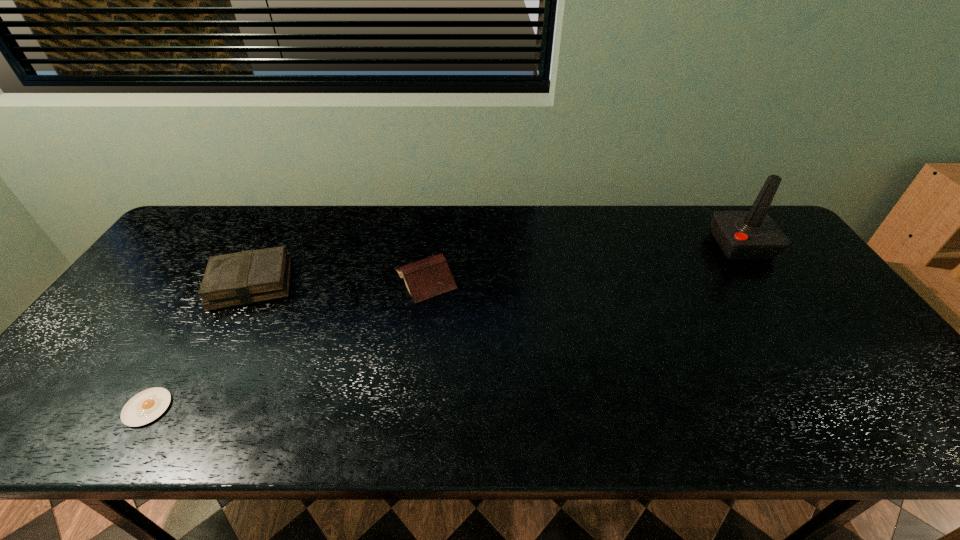
Find the location of `the rightmost object`. the rightmost object is located at coordinates (742, 235).

You are a GUI agent. You are given a task and a screenshot of the screen. Output one action in this format:
    pyautogui.click(x=<x>, y=<y>)
    Task: Click on the tallest object
    The image size is (960, 540).
    Given the screenshot: What is the action you would take?
    pyautogui.click(x=742, y=235)

Where is `the left book`? the left book is located at coordinates (247, 277).

Image resolution: width=960 pixels, height=540 pixels. Find the location of `the third object from left to right`. the third object from left to right is located at coordinates (431, 276).

Identify the location of the nearest object. (146, 406).

Where is `egg yolk`? This screenshot has width=960, height=540. egg yolk is located at coordinates (146, 406).

I want to click on free space located 0.250m on the front of the rightmost object, so click(x=798, y=327).

Where is `vacant space located 0.360m on the front of the left book`? Image resolution: width=960 pixels, height=540 pixels. vacant space located 0.360m on the front of the left book is located at coordinates (165, 441).

At what (x,y) coordinates should I click in order to perform the action: click on free space located 0.070m on the left of the right book. Please return your answer as a coordinate pair (x, y). Looking at the image, I should click on (368, 279).

Where is `vacant point located 0.250m on the back of the nearest object`? vacant point located 0.250m on the back of the nearest object is located at coordinates (208, 308).